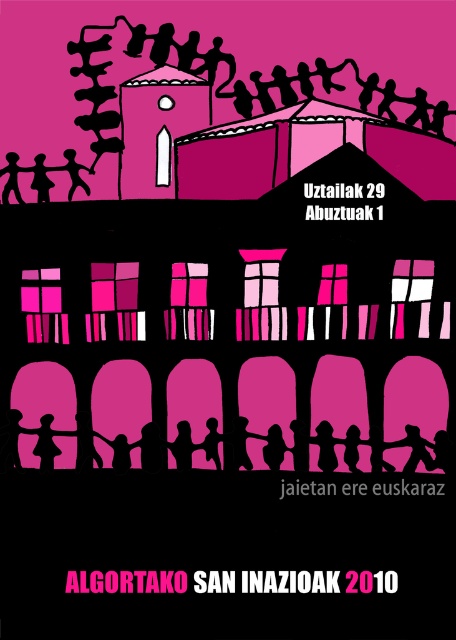
You are an art student analyzing the poster and want to determine the spatial relationship between the silhouette figure at lower center and the matte black figure at upper left. Based on the poster, which figure is positioned closer to the viewer?

The silhouette figure at lower center is closer to the viewer than the matte black figure at upper left.

You are standing in front of the poster and notice two points marked on it. The first point is at coordinate point (108, 442) and the second is at point (11, 156). Which point is closer to you?

Point (108, 442) is in front of point (11, 156), so the first point is closer to you.